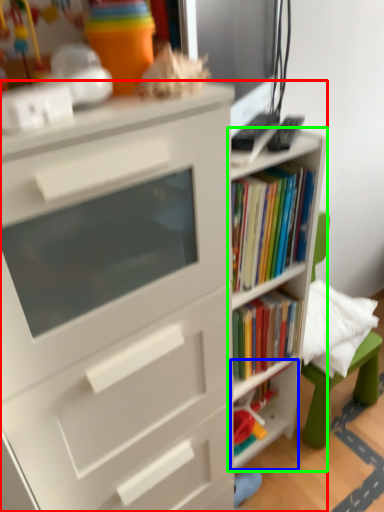
Question: Which object is the farthest from bookcase (highlighted by a red box)? Choose among these: shelf (highlighted by a blue box) or shelf (highlighted by a green box).

Choices:
 (A) shelf
 (B) shelf

Answer: (A)